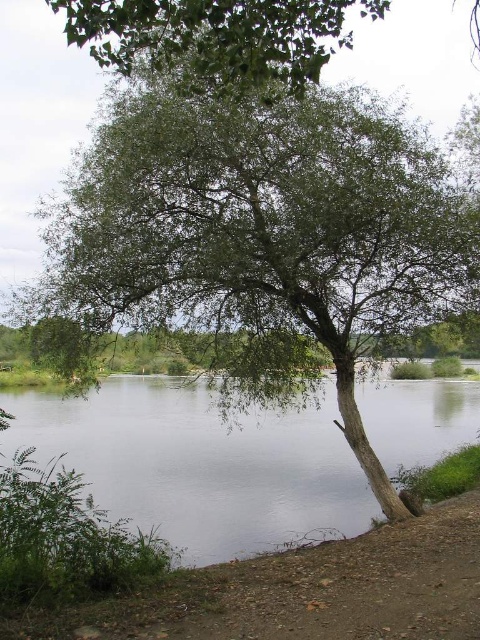
You are a photographer planning to capture the clear water at center and the green leafy tree at upper center in a single shot. Given that your camera can only focus on one object at a time, which object should you prioritize focusing on to ensure the larger object is sharp?

The clear water at center is larger in size than the green leafy tree at upper center, so you should prioritize focusing on the clear water at center to ensure the larger object is sharp.

You are a kayaker planning to navigate through the scene. The kayak is 2 meters wide. You see the clear water at center and the green leafy tree at upper center. Can you safely pass through the area between them?

The clear water at center might be wider than green leafy tree at upper center. Since the kayak is 2 meters wide, it depends on the actual width of the clear water. If the clear water is indeed wider than the tree, it might accommodate the kayak. However, without exact measurements, there is uncertainty.

You are a photographer planning to take a picture of the clear water at center and the green leafy tree at upper center. If you want to ensure both are in focus, which one should you position closer to the camera to achieve depth of field?

The clear water at center is positioned under the green leafy tree at upper center, so positioning the green leafy tree at upper center closer to the camera would help achieve depth of field for both subjects.